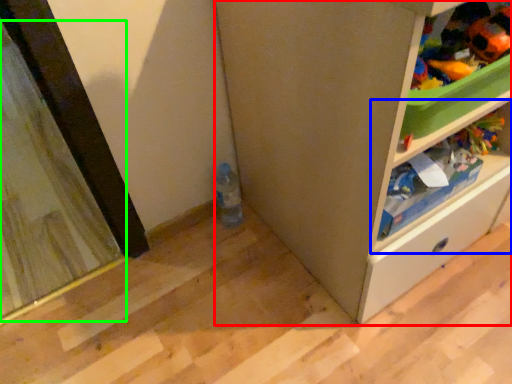
Question: Which is farther away from cabinetry (highlighted by a red box)? shelf (highlighted by a blue box) or screen door (highlighted by a green box)?

Choices:
 (A) shelf
 (B) screen door

Answer: (B)